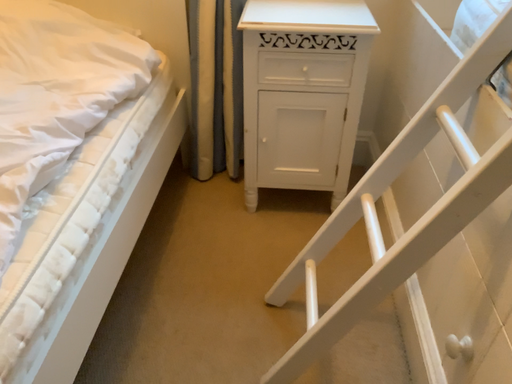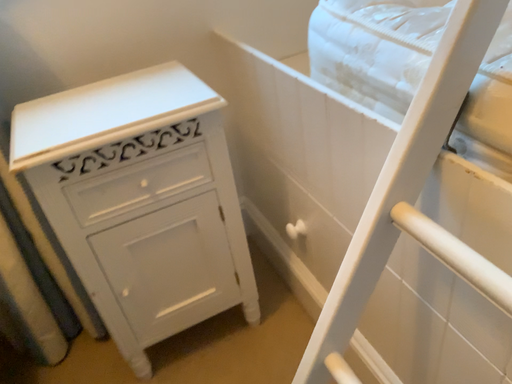
Question: How did the camera likely rotate when shooting the video?

Choices:
 (A) rotated upward
 (B) rotated downward

Answer: (A)